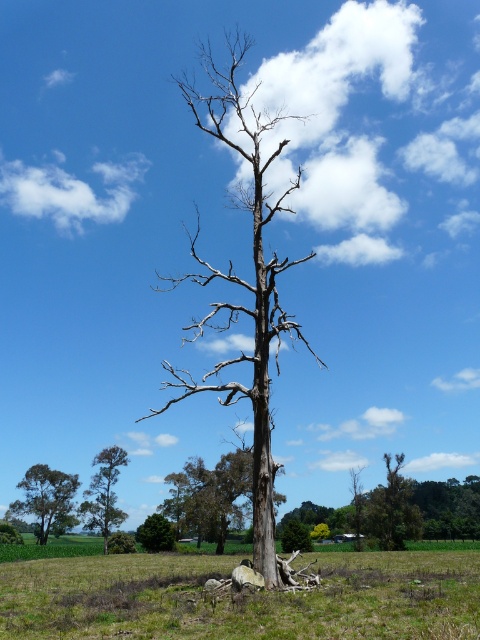
You are standing in the rural landscape shown in the image. There is a point marked at coordinates (242, 282). What object is located at this point?

The bare wood tree at center is located at point (242, 282).

You are a bird looking for a nesting spot. You see the bare wood tree at center and the brown rough bark tree at center. Which tree is taller and would provide a better vantage point?

The bare wood tree at center is taller than the brown rough bark tree at center, so it would provide a better vantage point for nesting.